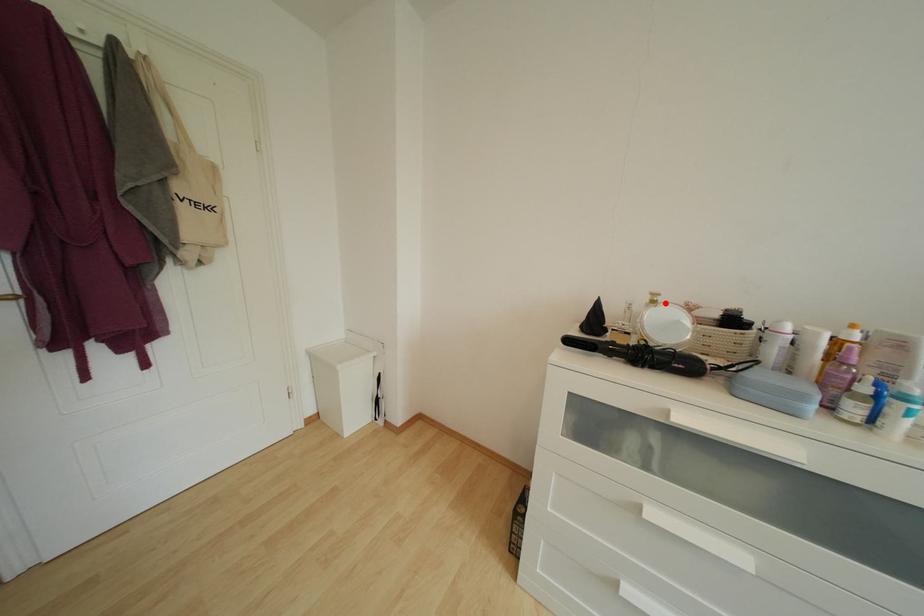
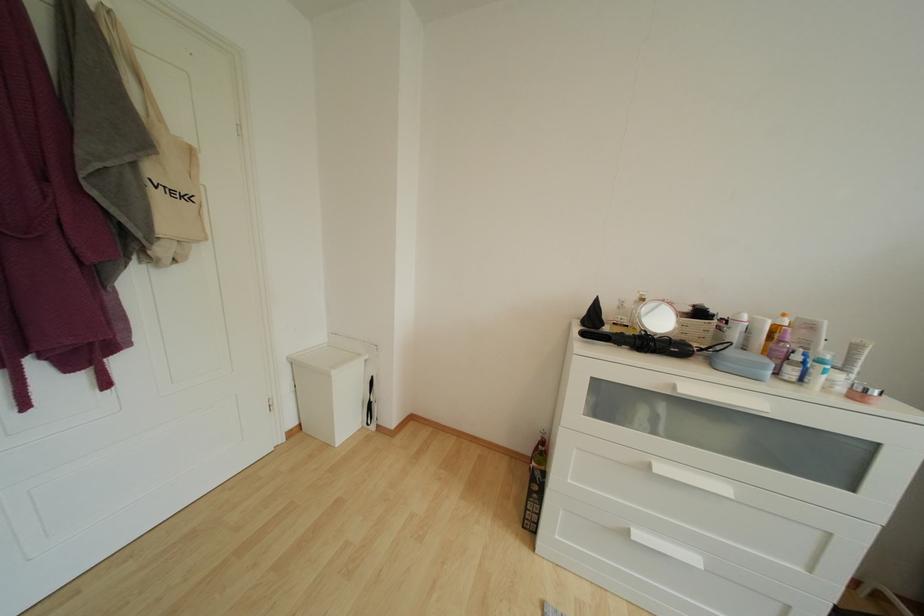
Locate, in the second image, the point that corresponds to the highlighted location in the first image.

(651, 301)